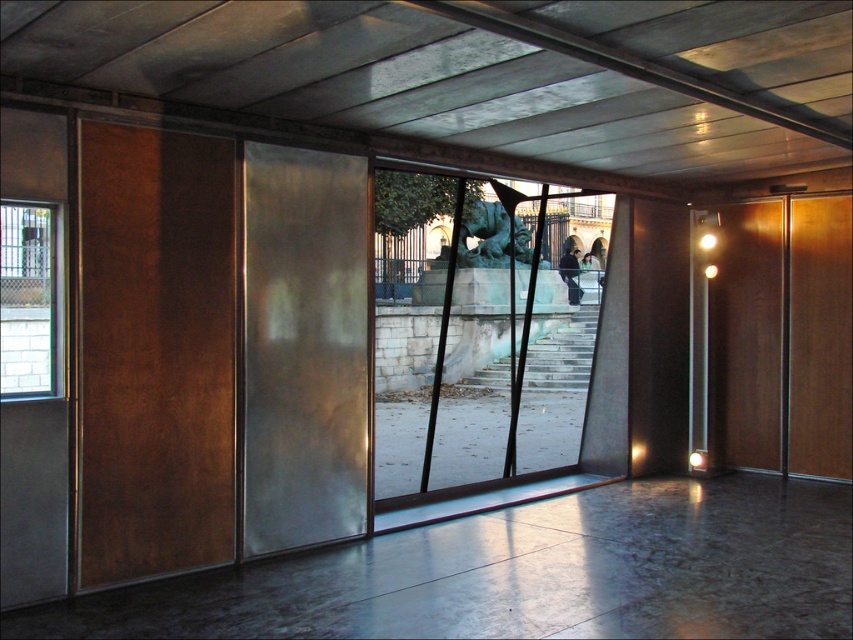
Is transparent glass door at center positioned behind satin silver door at center?

Yes, transparent glass door at center is further from the viewer.

Is transparent glass door at center thinner than satin silver door at center?

No.

The height and width of the screenshot is (640, 853). Identify the location of transparent glass door at center. (486, 340).

Is transparent glass door at center to the left of bronze statue at center from the viewer's perspective?

Indeed, transparent glass door at center is positioned on the left side of bronze statue at center.

Which is more to the right, transparent glass door at center or bronze statue at center?

bronze statue at center

Does point (445, 449) come behind point (505, 241)?

No, it is in front of (505, 241).

This screenshot has height=640, width=853. I want to click on transparent glass door at center, so click(x=486, y=340).

Who is positioned more to the right, rustic wood screen door at left or clear glass window at left?

Positioned to the right is rustic wood screen door at left.

Can you confirm if rustic wood screen door at left is thinner than clear glass window at left?

Yes, rustic wood screen door at left is thinner than clear glass window at left.

What do you see at coordinates (154, 353) in the screenshot?
I see `rustic wood screen door at left` at bounding box center [154, 353].

Locate an element on the screen. This screenshot has width=853, height=640. rustic wood screen door at left is located at coordinates (154, 353).